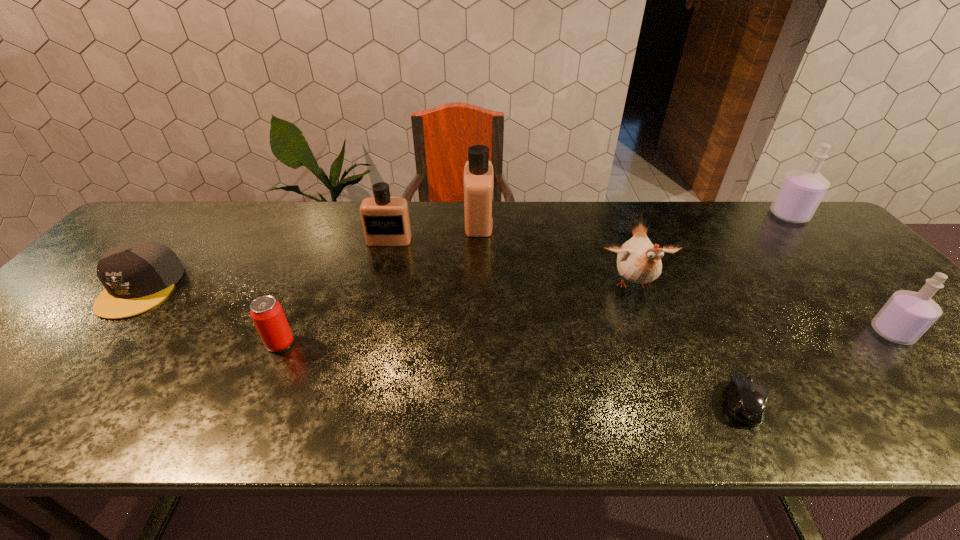
I want to click on the bigger purple perfume, so click(x=801, y=191).

This screenshot has height=540, width=960. What are the coordinates of `the fifth object from right to left` in the screenshot? It's located at (478, 171).

You are a GUI agent. You are given a task and a screenshot of the screen. Output one action in this format:
    pyautogui.click(x=<x>, y=<y>)
    Task: Click on the right beige perfume
    
    Given the screenshot: What is the action you would take?
    pyautogui.click(x=478, y=171)

You are a GUI agent. You are given a task and a screenshot of the screen. Output one action in this format:
    pyautogui.click(x=<x>, y=<y>)
    Task: Click on the bird
    This screenshot has width=960, height=540.
    Given the screenshot: What is the action you would take?
    pyautogui.click(x=639, y=261)

Identify the location of the nearest perfume. This screenshot has height=540, width=960. (907, 315).

You are a GUI agent. You are given a task and a screenshot of the screen. Output one action in this format:
    pyautogui.click(x=<x>, y=<y>)
    Task: Click on the nearer purple perfume
    This screenshot has height=540, width=960.
    Given the screenshot: What is the action you would take?
    pyautogui.click(x=907, y=315)

In order to click on the leftmost perfume in this screenshot , I will do `click(385, 220)`.

Locate an element on the screen. the third object from left to right is located at coordinates pos(385,220).

In order to click on the sixth tallest object in this screenshot , I will do `click(266, 312)`.

You are a GUI agent. You are given a task and a screenshot of the screen. Output one action in this format:
    pyautogui.click(x=<x>, y=<y>)
    Task: Click on the beer can
    
    Given the screenshot: What is the action you would take?
    pyautogui.click(x=266, y=312)